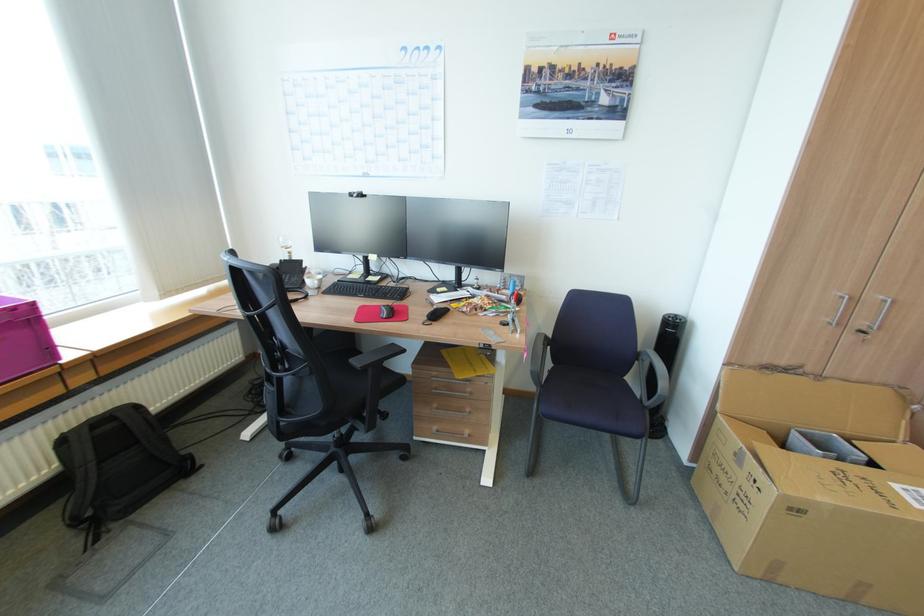
The height and width of the screenshot is (616, 924). Identify the location of cabinet door lock. (864, 337).